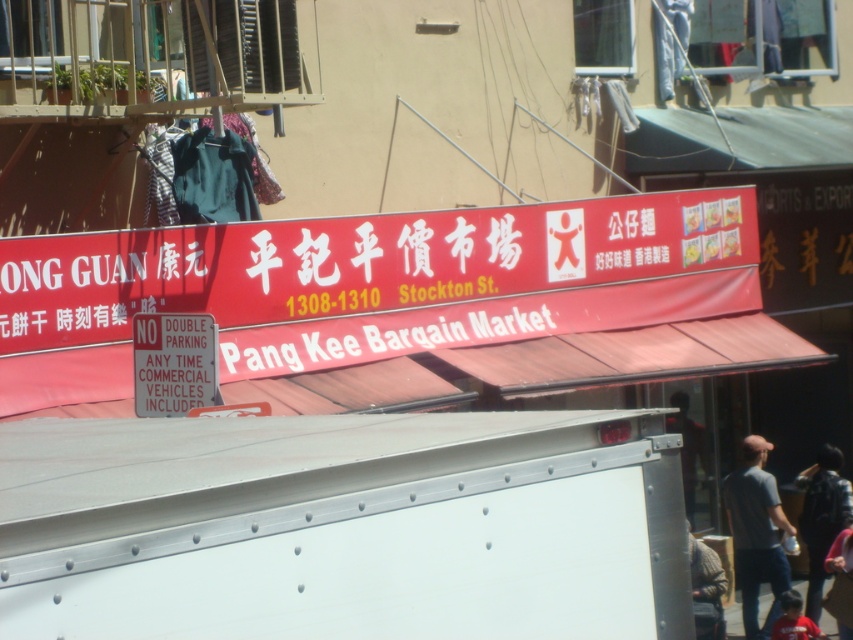
Is red matte signboard at upper center taller than dark brown leather jacket at lower right?

In fact, red matte signboard at upper center may be shorter than dark brown leather jacket at lower right.

Measure the distance between red matte signboard at upper center and dark brown leather jacket at lower right.

A distance of 8.06 meters exists between red matte signboard at upper center and dark brown leather jacket at lower right.

Does point (473, 228) lie behind point (828, 513)?

No.

Where is `red matte signboard at upper center`? This screenshot has width=853, height=640. red matte signboard at upper center is located at coordinates (357, 262).

The image size is (853, 640). I want to click on matte plastic sign at center, so click(x=173, y=364).

Which of these two, matte plastic sign at center or brown knitted sweater at lower right, stands shorter?

matte plastic sign at center

Which is in front, point (170, 368) or point (700, 618)?

Point (170, 368) is more forward.

In order to click on matte plastic sign at center in this screenshot , I will do `click(173, 364)`.

Which is more to the right, dark brown leather jacket at lower right or red shirt at lower right?

Positioned to the right is dark brown leather jacket at lower right.

Is point (836, 461) positioned behind point (787, 598)?

Yes, point (836, 461) is farther from viewer.

I want to click on dark brown leather jacket at lower right, so click(822, 516).